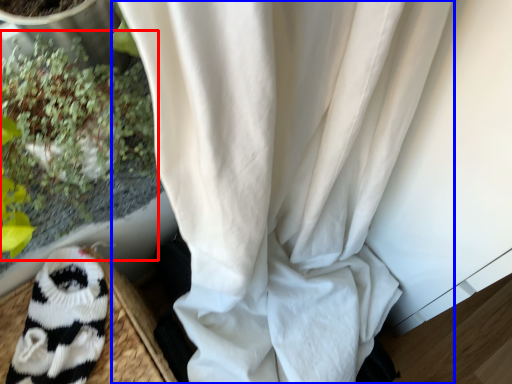
Question: Which object appears closest to the camera in this image, floral arrangement (highlighted by a red box) or curtain (highlighted by a blue box)?

Choices:
 (A) floral arrangement
 (B) curtain

Answer: (A)